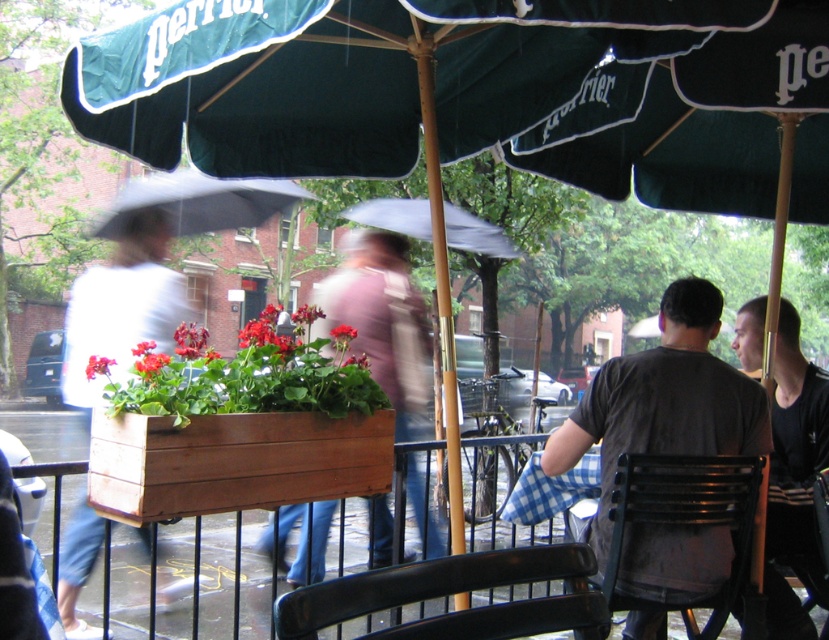
You are a customer at the outdoor cafe and want to sit at the blue checkered tablecloth at lower center. You see a person wearing a dark gray shirt at right walking towards the table. Which side of the table is the person approaching from?

The dark gray shirt at right is to the right of the blue checkered tablecloth at lower center, so the person is approaching from the right side of the table.

You are a customer at the outdoor cafe and want to sit at the blue checkered tablecloth at lower center. However, there is a person wearing a dark gray shirt at right blocking your path. Can you easily walk around them to reach the table?

The dark gray shirt at right is in front of the blue checkered tablecloth at lower center, so the person is blocking the direct path to the table. You will need to walk around them to reach the table.

You are a customer waiting at the outdoor cafe. You notice two people passing by wearing the dark gray shirt at right and the white cotton shirt at left. Which person is closer to the wooden planter box with red flowers?

The white cotton shirt at left is closer to the wooden planter box with red flowers because the dark gray shirt at right is positioned to its right, meaning the white cotton shirt at left is on the left side, which is closer to the planter box located on the right side of the scene.